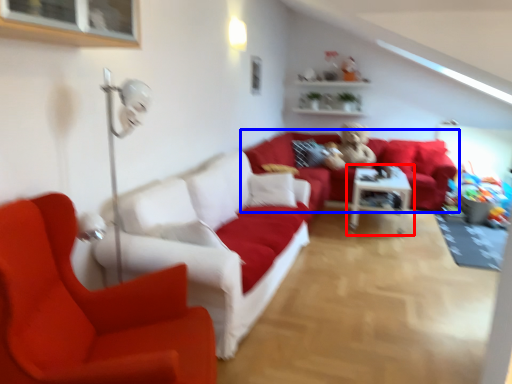
Question: Which of the following is the farthest to the observer, table (highlighted by a red box) or studio couch (highlighted by a blue box)?

Choices:
 (A) table
 (B) studio couch

Answer: (B)